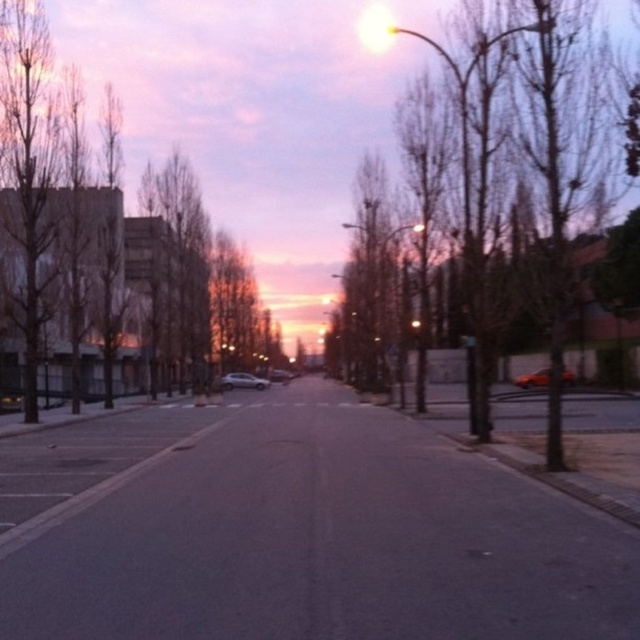
Who is more forward, [257,387] or [282,378]?

Point [257,387]

In the scene shown: Does satin silver car at center appear on the right side of satin silver sedan at center?

In fact, satin silver car at center is to the left of satin silver sedan at center.

Is point (225, 385) farther from viewer compared to point (275, 372)?

That is False.

This screenshot has height=640, width=640. What are the coordinates of `satin silver car at center` in the screenshot? It's located at (243, 381).

Is bare branches at center smaller than metallic orange car at center?

Incorrect, bare branches at center is not smaller in size than metallic orange car at center.

Is bare branches at center positioned at the back of metallic orange car at center?

No, it is not.

Does point (532, 67) come closer to viewer compared to point (541, 374)?

Yes, it is in front of point (541, 374).

The image size is (640, 640). I want to click on bare branches at center, so pos(525,166).

Does brown leafless tree at left appear on the left side of satin silver car at center?

Yes, brown leafless tree at left is to the left of satin silver car at center.

Can you confirm if brown leafless tree at left is smaller than satin silver car at center?

No.

Measure the distance between point (54, 349) and camera.

Point (54, 349) is 147.36 feet away from camera.

Identify the location of brown leafless tree at left. This screenshot has width=640, height=640. (106, 250).